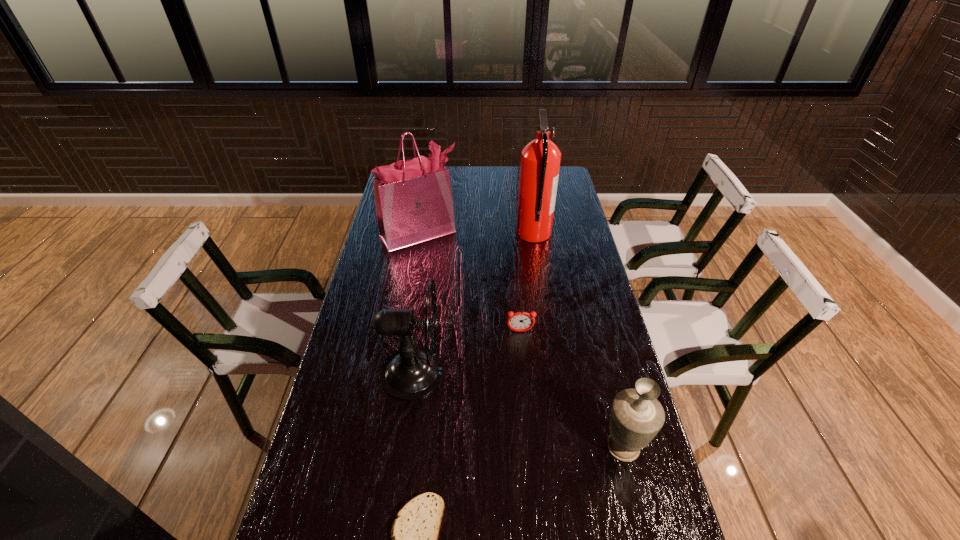
Where is `fire extinguisher`? fire extinguisher is located at coordinates (540, 159).

The height and width of the screenshot is (540, 960). In order to click on shopping bag in this screenshot , I will do `click(413, 198)`.

Identify the location of fan. The width and height of the screenshot is (960, 540). (412, 372).

You are a GUI agent. You are given a task and a screenshot of the screen. Output one action in this format:
    pyautogui.click(x=<x>, y=<y>)
    Task: Click on the fourth farthest object
    
    Given the screenshot: What is the action you would take?
    pyautogui.click(x=412, y=372)

This screenshot has height=540, width=960. Find the location of `urn`. urn is located at coordinates (636, 417).

Find the location of `the fourth tallest object`. the fourth tallest object is located at coordinates (636, 417).

Locate an element on the screen. This screenshot has width=960, height=540. alarm clock is located at coordinates (521, 321).

Find the location of a particular element. This screenshot has width=960, height=540. the fourth nearest object is located at coordinates (521, 321).

Find the location of `vacant space positioned at the nozzle of the fire extinguisher`. vacant space positioned at the nozzle of the fire extinguisher is located at coordinates (463, 233).

Where is `free spot located at the nozzle of the fire extinguisher`? The image size is (960, 540). free spot located at the nozzle of the fire extinguisher is located at coordinates (496, 233).